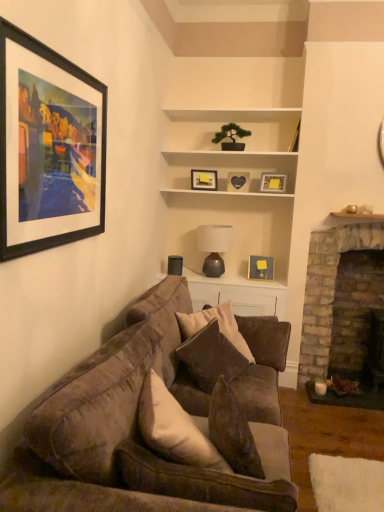
What are the coordinates of `vacant area on top of matte black picture frame at upper left, positioned as the fifth picture frame in right-to-left order (from a real-world perspective)` in the screenshot? It's located at (63, 58).